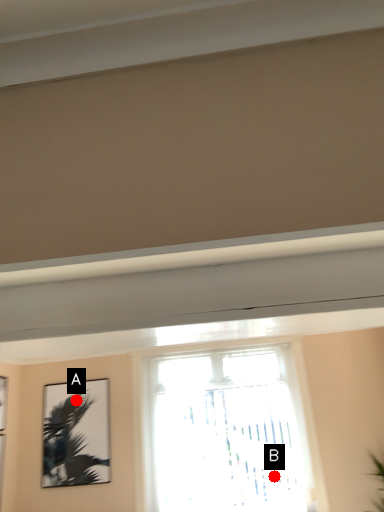
Question: Two points are circled on the image, labeled by A and B beside each circle. Which point appears closest to the camera in this image?

Choices:
 (A) A is closer
 (B) B is closer

Answer: (B)